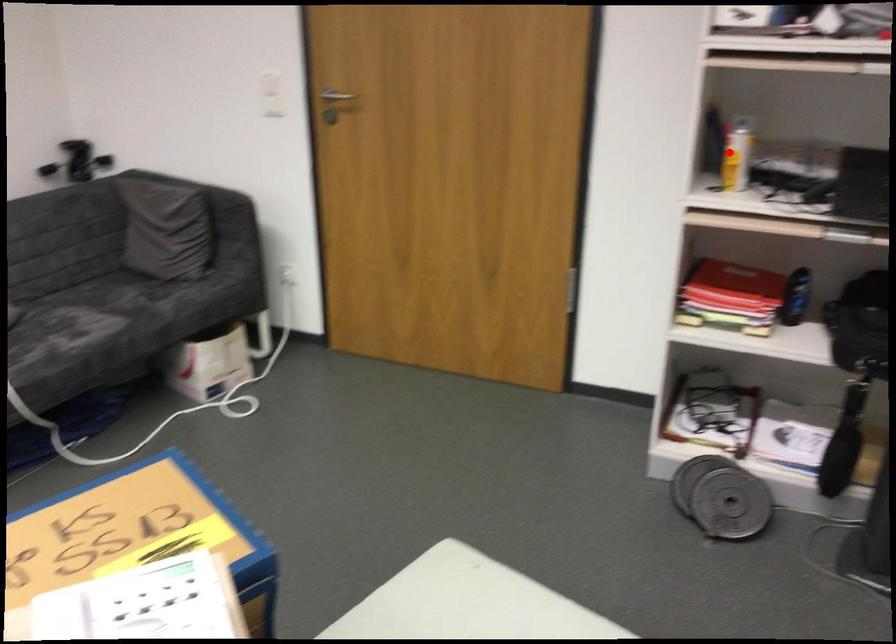
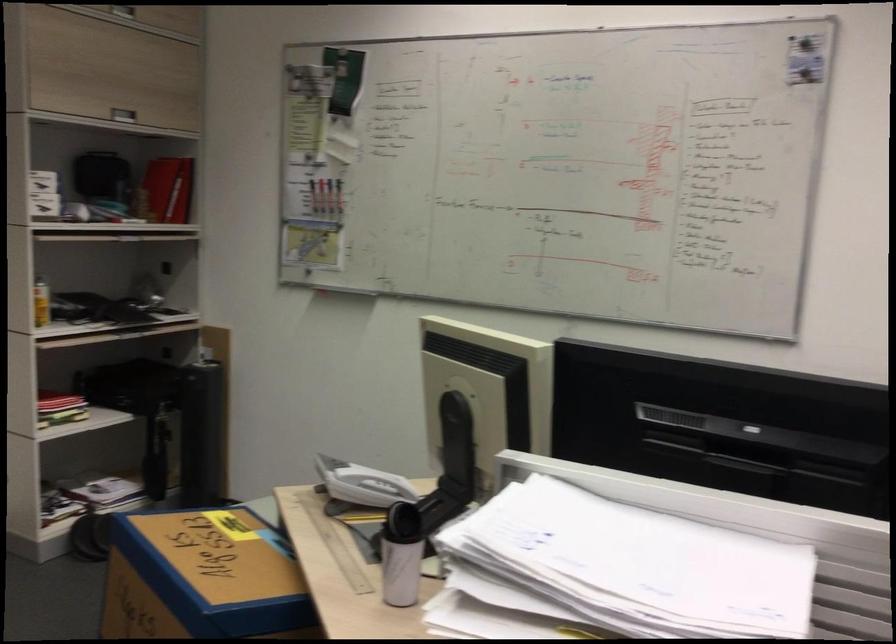
In the second image, find the point that corresponds to the highlighted location in the first image.

(40, 303)